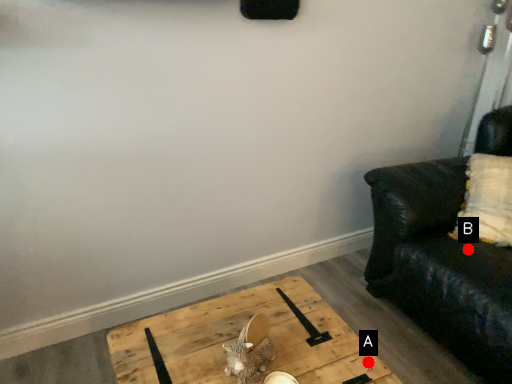
Question: Two points are circled on the image, labeled by A and B beside each circle. Which point is closer to the camera?

Choices:
 (A) A is closer
 (B) B is closer

Answer: (A)